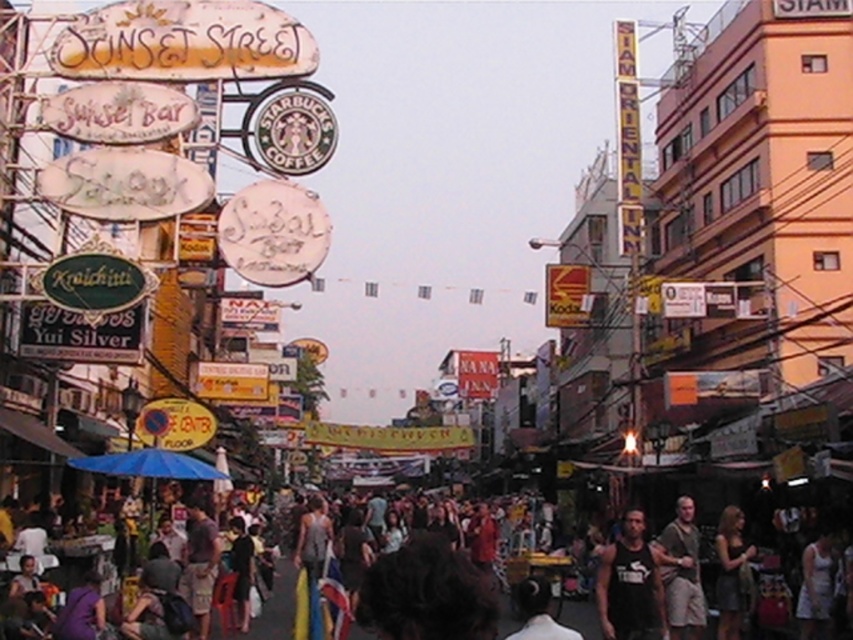
Can you confirm if brown textured shirt at lower right is positioned to the left of dark brown leather jacket at lower right?

Correct, you'll find brown textured shirt at lower right to the left of dark brown leather jacket at lower right.

Does brown textured shirt at lower right appear under dark brown leather jacket at lower right?

No, brown textured shirt at lower right is not below dark brown leather jacket at lower right.

Locate an element on the screen. The image size is (853, 640). brown textured shirt at lower right is located at coordinates (682, 572).

Find the location of a particular element. This screenshot has height=640, width=853. brown textured shirt at lower right is located at coordinates (682, 572).

Does black tank top at lower right have a greater height compared to dark brown leather jacket at lower right?

In fact, black tank top at lower right may be shorter than dark brown leather jacket at lower right.

Locate an element on the screen. This screenshot has width=853, height=640. black tank top at lower right is located at coordinates (630, 586).

Identify the location of black tank top at lower right. The height and width of the screenshot is (640, 853). (630, 586).

What are the coordinates of `black tank top at lower right` in the screenshot? It's located at (630, 586).

Where is `black tank top at lower right`? black tank top at lower right is located at coordinates (630, 586).

Between black tank top at lower right and brown textured shirt at lower right, which one is positioned lower?

black tank top at lower right is lower down.

Who is more distant from viewer, (625, 541) or (654, 544)?

The point (654, 544) is behind.

Identify the location of black tank top at lower right. The height and width of the screenshot is (640, 853). (630, 586).